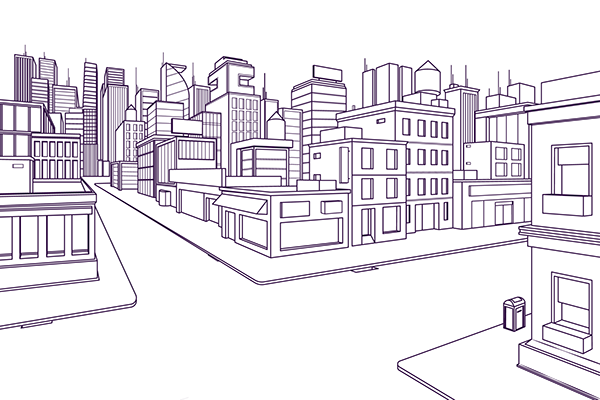
Where is `window ledge or place to put plants`? The image size is (600, 400). window ledge or place to put plants is located at coordinates (571, 337), (566, 209).